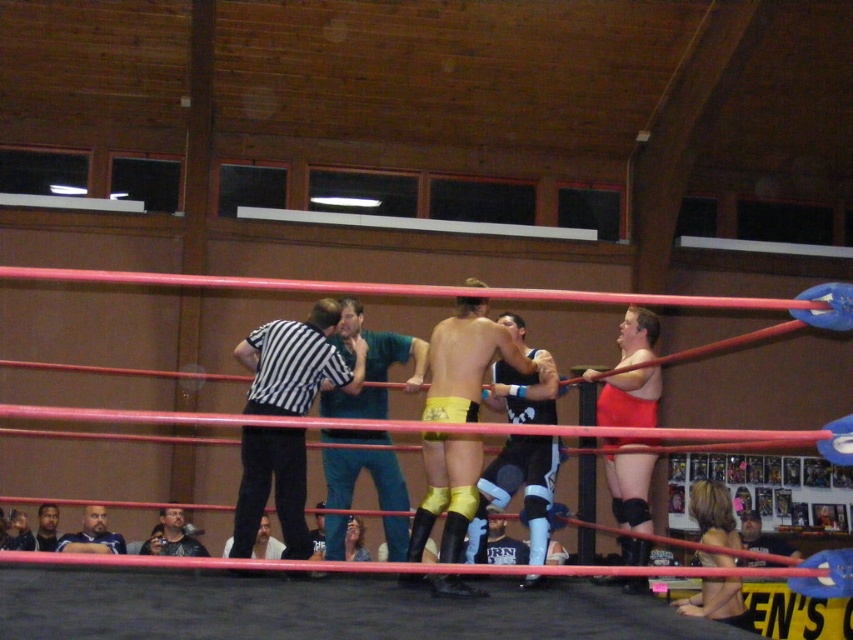
Question: Which point is closer to the camera taking this photo?

Choices:
 (A) (41, 529)
 (B) (457, 541)
 (C) (161, 554)

Answer: (B)

Question: Among these points, which one is nearest to the camera?

Choices:
 (A) (173, 508)
 (B) (263, 554)

Answer: (A)

Question: Does dark brown leather jacket at lower left have a lesser width compared to smooth black shirt at center?

Choices:
 (A) yes
 (B) no

Answer: (A)

Question: Does smooth blue shirt at center appear on the right side of dark brown leather jacket at lower left?

Choices:
 (A) yes
 (B) no

Answer: (A)

Question: Which of the following is the closest to the observer?

Choices:
 (A) (741, 520)
 (B) (165, 512)
 (C) (109, 547)
 (D) (392, 474)

Answer: (D)

Question: Is yellow fabric shorts at center wider than teal fabric shirt at center?

Choices:
 (A) yes
 (B) no

Answer: (A)